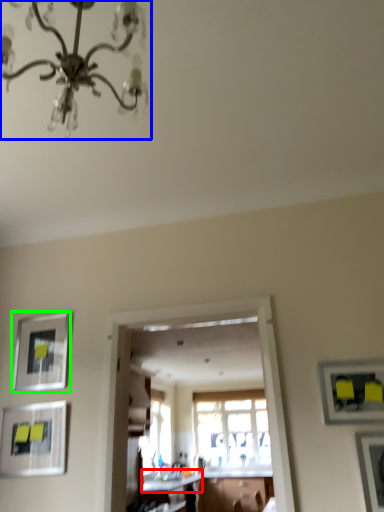
Question: Which object is positioned closest to counter top (highlighted by a red box)? Select from chandelier (highlighted by a blue box) and picture frame (highlighted by a green box).

Choices:
 (A) chandelier
 (B) picture frame

Answer: (B)